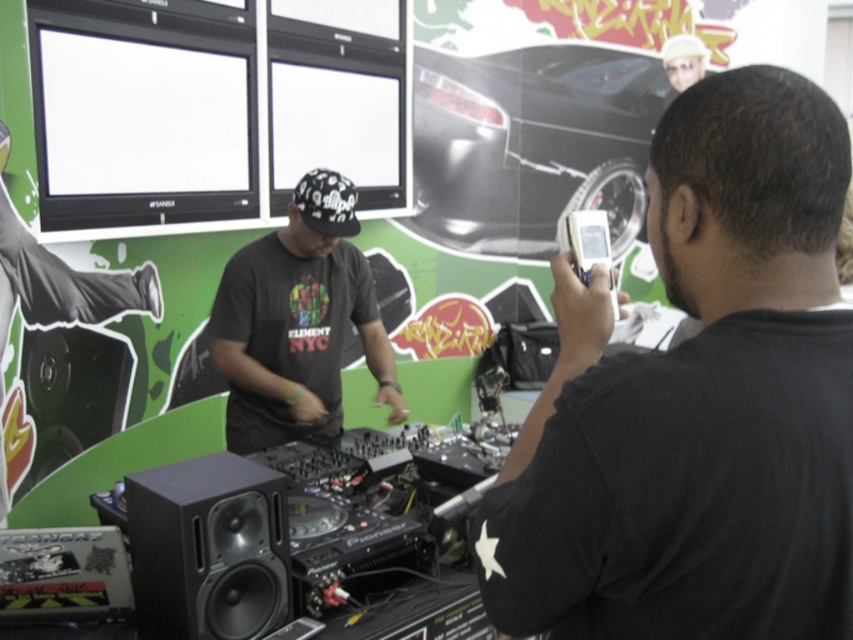
What do you see at coordinates (698, 401) in the screenshot? Image resolution: width=853 pixels, height=640 pixels. I see `black matte shirt at right` at bounding box center [698, 401].

Locate an element on the screen. This screenshot has height=640, width=853. black matte shirt at right is located at coordinates (698, 401).

Locate an element on the screen. This screenshot has height=640, width=853. black matte shirt at right is located at coordinates (698, 401).

Does black matte shirt at right have a larger size compared to black matte speaker at lower left?

Correct, black matte shirt at right is larger in size than black matte speaker at lower left.

Is point (732, 83) positioned after point (231, 500)?

No, (732, 83) is closer to viewer.

Who is more forward, (x=674, y=192) or (x=164, y=609)?

Point (x=674, y=192) is in front.

In order to click on black matte shirt at right in this screenshot , I will do `click(698, 401)`.

Who is more distant from viewer, (279,236) or (283,481)?

Point (279,236)

Between black matte t-shirt at center and black matte speaker at lower left, which one is positioned higher?

black matte t-shirt at center is higher up.

Locate an element on the screen. The height and width of the screenshot is (640, 853). black matte t-shirt at center is located at coordinates (299, 323).